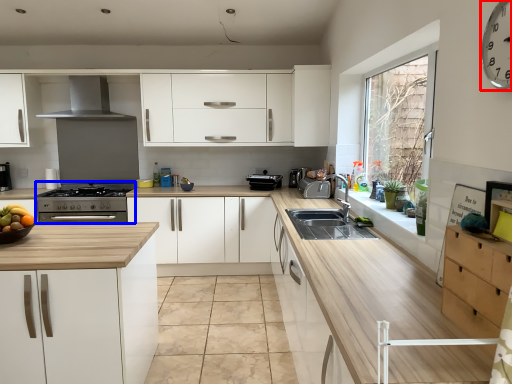
Question: Which point is closer to the camera, clock (highlighted by a red box) or appliance (highlighted by a blue box)?

Choices:
 (A) clock
 (B) appliance

Answer: (A)